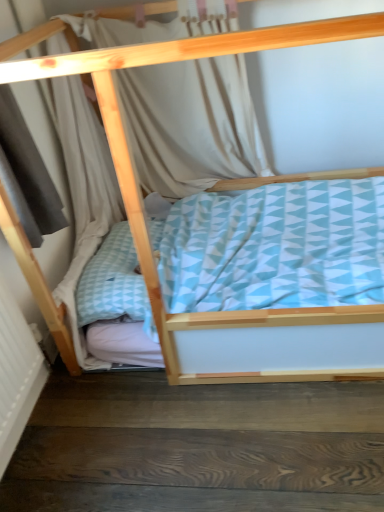
Find the location of a particular element. dark wood stair at lower left is located at coordinates (198, 447).

Image resolution: width=384 pixels, height=512 pixels. What do you see at coordinates (198, 447) in the screenshot?
I see `dark wood stair at lower left` at bounding box center [198, 447].

Image resolution: width=384 pixels, height=512 pixels. Find the location of `light beige fabric curtain at upper center`. light beige fabric curtain at upper center is located at coordinates (191, 124).

What do you see at coordinates (191, 124) in the screenshot? I see `light beige fabric curtain at upper center` at bounding box center [191, 124].

Locate an element on the screen. The image size is (384, 512). dark wood stair at lower left is located at coordinates (198, 447).

Between dark wood stair at lower left and light beige fabric curtain at upper center, which one appears on the left side from the viewer's perspective?

light beige fabric curtain at upper center is more to the left.

Considering their positions, is dark wood stair at lower left located in front of or behind light beige fabric curtain at upper center?

In the image, dark wood stair at lower left appears in front of light beige fabric curtain at upper center.

Does point (168, 487) come behind point (248, 163)?

No, (168, 487) is in front of (248, 163).

From the image's perspective, is dark wood stair at lower left on light beige fabric curtain at upper center?

Actually, dark wood stair at lower left appears below light beige fabric curtain at upper center in the image.

From a real-world perspective, who is located lower, dark wood stair at lower left or light beige fabric curtain at upper center?

From a 3D spatial view, dark wood stair at lower left is below.

Which object is wider, dark wood stair at lower left or light beige fabric curtain at upper center?

dark wood stair at lower left is wider.

In terms of height, does dark wood stair at lower left look taller or shorter compared to light beige fabric curtain at upper center?

dark wood stair at lower left is shorter than light beige fabric curtain at upper center.

Between dark wood stair at lower left and light beige fabric curtain at upper center, which one has smaller size?

With smaller size is dark wood stair at lower left.

Is dark wood stair at lower left not within light beige fabric curtain at upper center?

Indeed, dark wood stair at lower left is completely outside light beige fabric curtain at upper center.

Is dark wood stair at lower left with light beige fabric curtain at upper center?

No.

Does dark wood stair at lower left turn towards light beige fabric curtain at upper center?

No, dark wood stair at lower left is not aimed at light beige fabric curtain at upper center.

Find the location of a particular element. The height and width of the screenshot is (512, 384). stair below the light beige fabric curtain at upper center (from the image's perspective) is located at coordinates (198, 447).

Between light beige fabric curtain at upper center and dark wood stair at lower left, which one appears on the right side from the viewer's perspective?

Positioned to the right is dark wood stair at lower left.

From the picture: Is light beige fabric curtain at upper center positioned behind dark wood stair at lower left?

Yes, it is behind dark wood stair at lower left.

Is point (172, 94) in front of point (38, 452)?

That is False.

From the image's perspective, which one is positioned lower, light beige fabric curtain at upper center or dark wood stair at lower left?

dark wood stair at lower left.

From a real-world perspective, between light beige fabric curtain at upper center and dark wood stair at lower left, who is vertically higher?

From a 3D spatial view, light beige fabric curtain at upper center is above.

Which object is thinner, light beige fabric curtain at upper center or dark wood stair at lower left?

light beige fabric curtain at upper center.

Considering the relative sizes of light beige fabric curtain at upper center and dark wood stair at lower left in the image provided, is light beige fabric curtain at upper center taller than dark wood stair at lower left?

Yes.

Between light beige fabric curtain at upper center and dark wood stair at lower left, which one has smaller size?

dark wood stair at lower left.

Is light beige fabric curtain at upper center spatially inside dark wood stair at lower left, or outside of it?

light beige fabric curtain at upper center lies outside dark wood stair at lower left.

Would you consider light beige fabric curtain at upper center to be distant from dark wood stair at lower left?

That's right, there is a large distance between light beige fabric curtain at upper center and dark wood stair at lower left.

Is light beige fabric curtain at upper center facing away from dark wood stair at lower left?

No, dark wood stair at lower left is not at the back of light beige fabric curtain at upper center.

Consider the image. How many degrees apart are the facing directions of light beige fabric curtain at upper center and dark wood stair at lower left?

They differ by 179 degrees in their facing directions.

Measure the distance between light beige fabric curtain at upper center and dark wood stair at lower left.

4.00 feet.

Find the location of a particular element. The width and height of the screenshot is (384, 512). stair directly beneath the light beige fabric curtain at upper center (from a real-world perspective) is located at coordinates (198, 447).

Where is `stair in front of the light beige fabric curtain at upper center`? This screenshot has width=384, height=512. stair in front of the light beige fabric curtain at upper center is located at coordinates (198, 447).

Locate an element on the screen. This screenshot has width=384, height=512. stair lying below the light beige fabric curtain at upper center (from the image's perspective) is located at coordinates (198, 447).